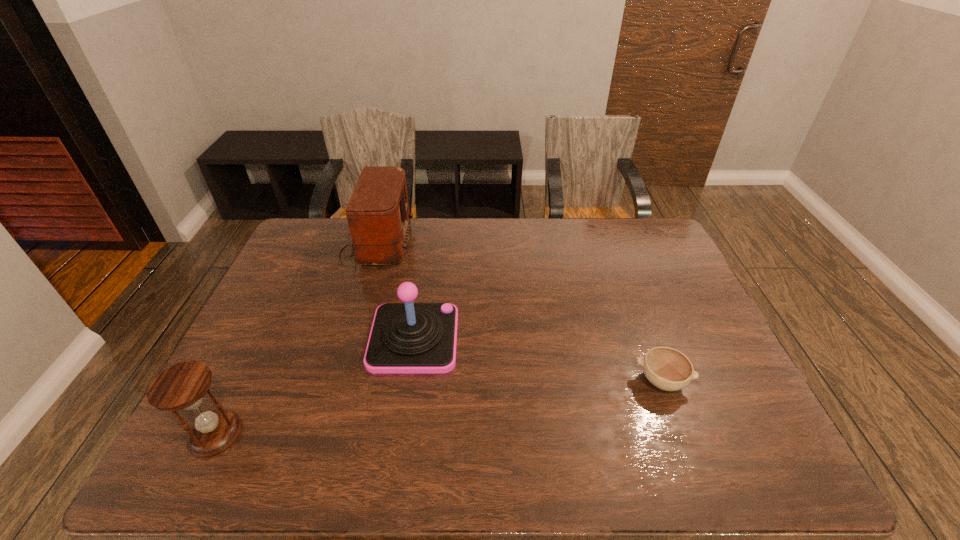
The image size is (960, 540). In order to click on free region at the far right corner in this screenshot , I will do `click(642, 258)`.

Find the location of a particular element. empty space between the radio receiver and the nearest object is located at coordinates (296, 338).

The image size is (960, 540). I want to click on vacant area between the leftmost object and the rightmost object, so click(x=439, y=407).

This screenshot has width=960, height=540. In order to click on empty space that is in between the bowl and the joystick in this screenshot , I will do `click(538, 360)`.

Where is `vacant area that lies between the farthest object and the joystick`? The height and width of the screenshot is (540, 960). vacant area that lies between the farthest object and the joystick is located at coordinates (395, 291).

Find the location of a particular element. The height and width of the screenshot is (540, 960). free space between the radio receiver and the bowl is located at coordinates (518, 312).

Where is `vacant area between the bowl and the farthest object`? The image size is (960, 540). vacant area between the bowl and the farthest object is located at coordinates (518, 312).

The width and height of the screenshot is (960, 540). I want to click on blank region between the bowl and the nearest object, so click(x=439, y=407).

Locate an element on the screen. This screenshot has height=540, width=960. unoccupied area between the farthest object and the shortest object is located at coordinates (518, 312).

I want to click on free spot between the farthest object and the hourglass, so click(x=296, y=338).